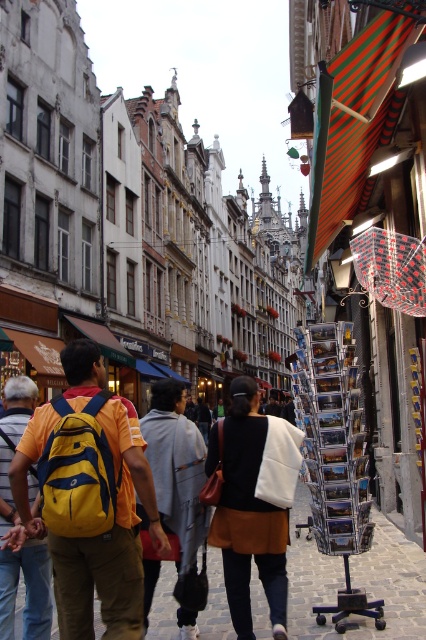
Is brown cobblestone pavement at center in front of gray cotton hoodie at center?

No.

Is brown cobblestone pavement at center further to the viewer compared to gray cotton hoodie at center?

Yes, it is behind gray cotton hoodie at center.

Describe the element at coordinates (356, 580) in the screenshot. I see `brown cobblestone pavement at center` at that location.

This screenshot has height=640, width=426. Identify the location of brown cobblestone pavement at center. (356, 580).

Does white cotton jacket at center have a lesser width compared to yellow backpack at left?

No, white cotton jacket at center is not thinner than yellow backpack at left.

Is point (215, 460) positioned in front of point (2, 588)?

No, (215, 460) is behind (2, 588).

Who is more distant from viewer, (267, 577) or (13, 385)?

Positioned behind is point (13, 385).

Locate an element on the screen. This screenshot has height=640, width=426. white cotton jacket at center is located at coordinates pyautogui.click(x=253, y=502).

Who is shorter, yellow fabric backpack at center or brown cobblestone pavement at center?

brown cobblestone pavement at center

The image size is (426, 640). What do you see at coordinates (109, 540) in the screenshot?
I see `yellow fabric backpack at center` at bounding box center [109, 540].

You are a GUI agent. You are given a task and a screenshot of the screen. Output one action in this format:
    pyautogui.click(x=<x>, y=<y>)
    Task: Click on the yellow fabric backpack at center
    The image size is (426, 640).
    Given the screenshot: What is the action you would take?
    pyautogui.click(x=109, y=540)